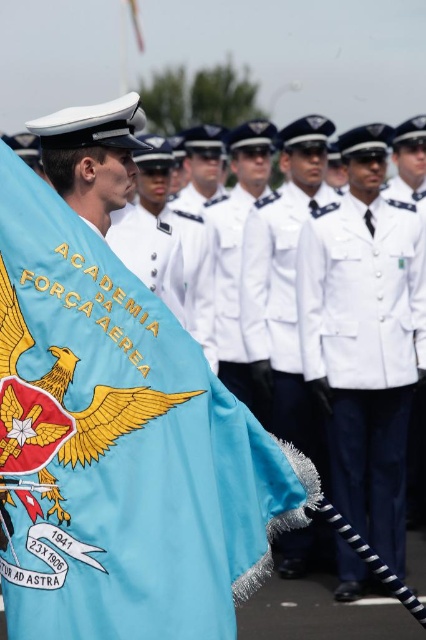
You are an observer at the military parade. You notice the light blue fabric flag at center and the white matte uniform at center. Which object appears smaller in the scene?

The light blue fabric flag at center appears smaller compared to the white matte uniform at center.

You are a photographer at the military parade. You need to capture a photo where the light blue fabric flag at center is fully visible without any part being hidden by the white matte uniform at center. Based on their sizes, is this possible?

The light blue fabric flag at center is wider than the white matte uniform at center, so it is possible to position the camera so that the flag remains fully visible without being obscured by the uniform.

You are a photographer standing at a certain position and want to capture the light blue fabric flag at center in your shot. The camera you are using has a maximum focus range of 25 feet. Can you take a clear photo of the flag without moving closer?

The light blue fabric flag at center and camera are 25.29 feet apart, which exceeds the camera maximum focus range of 25 feet. Therefore, you cannot take a clear photo of the flag without moving closer.